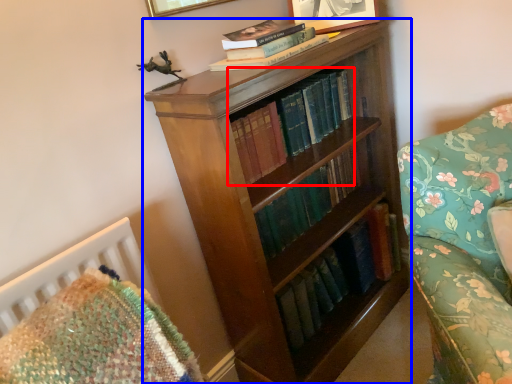
Question: Which object appears farthest to the camera in this image, book (highlighted by a red box) or bookcase (highlighted by a blue box)?

Choices:
 (A) book
 (B) bookcase

Answer: (A)